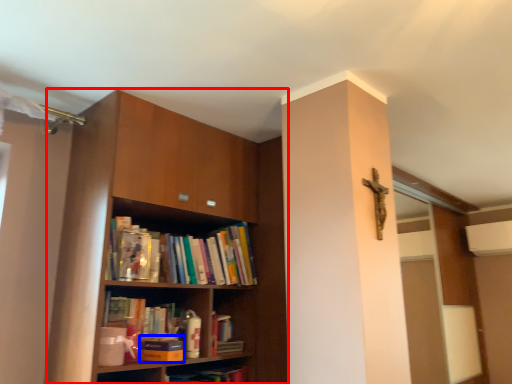
Question: Which object appears farthest to the camera in this image, shelf (highlighted by a red box) or paperback book (highlighted by a blue box)?

Choices:
 (A) shelf
 (B) paperback book

Answer: (B)